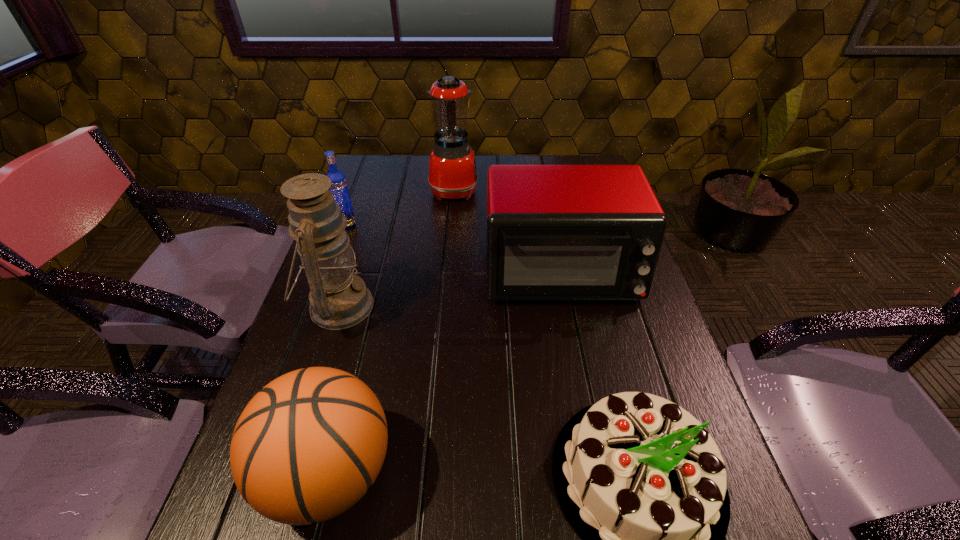
The height and width of the screenshot is (540, 960). Identify the location of object that is the closest one to the basketball. (339, 299).